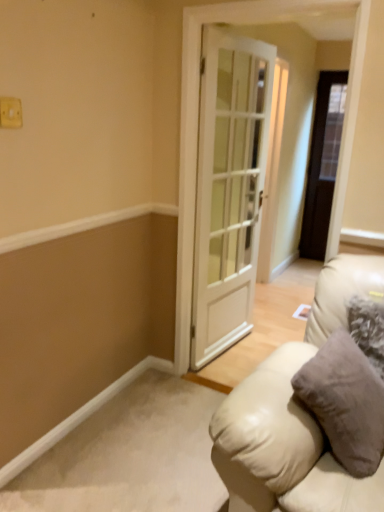
Question: From the image's perspective, is beige leather couch at lower right located above or below dark wood door at right, marked as the second door in a front-to-back arrangement?

Choices:
 (A) above
 (B) below

Answer: (B)

Question: Is beige leather couch at lower right wider or thinner than dark wood door at right, which is the 1th door in back-to-front order?

Choices:
 (A) wide
 (B) thin

Answer: (A)

Question: Which object is the closest to the dark wood door at right, placed as the 1th door when sorted from right to left?

Choices:
 (A) white glass door at center, the 2th door in the right-to-left sequence
 (B) white plastic light switch at upper left
 (C) beige leather couch at lower right

Answer: (A)

Question: Based on their relative distances, which object is nearer to the white glass door at center, the 1th door from the left?

Choices:
 (A) beige leather couch at lower right
 (B) dark wood door at right, arranged as the 2th door when viewed from the left
 (C) white plastic light switch at upper left

Answer: (A)